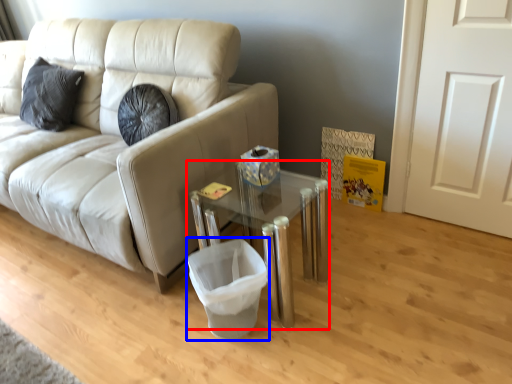
Question: Which object appears farthest to the camera in this image, table (highlighted by a red box) or laundry basket (highlighted by a blue box)?

Choices:
 (A) table
 (B) laundry basket

Answer: (B)